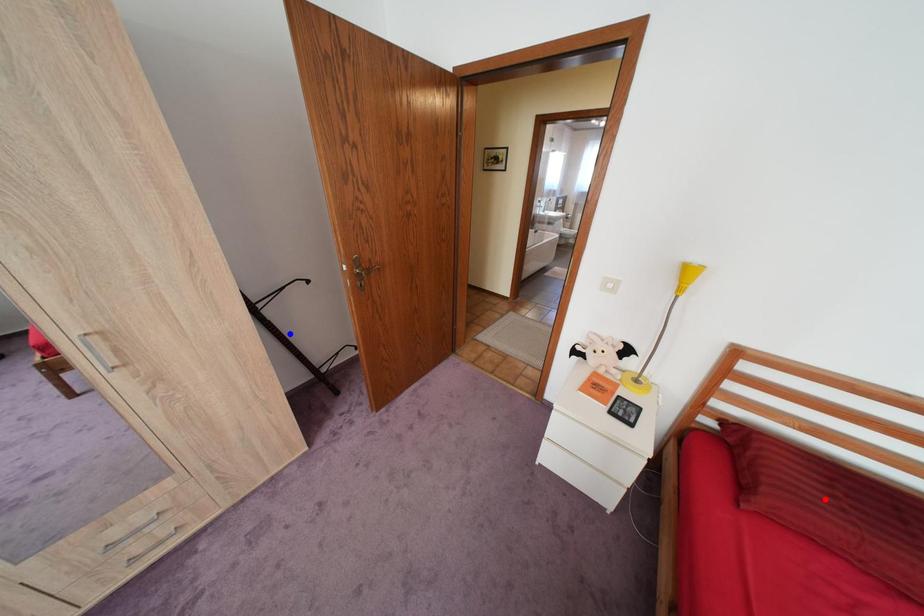
Question: Which of the two points in the image is closer to the camera?

Choices:
 (A) Blue point is closer.
 (B) Red point is closer.

Answer: (B)